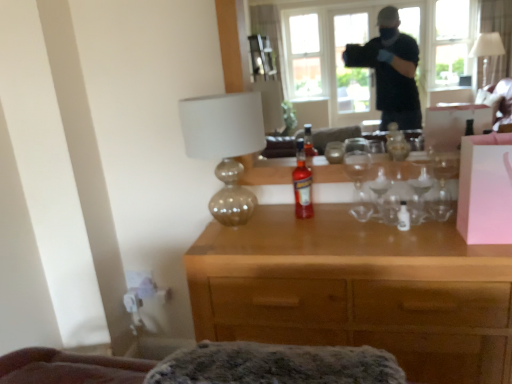
At what (x,y) coordinates should I click in order to perform the action: click on vacant region below matte gold lamp at center (from a real-world perspective). Please return your answer as a coordinate pair (x, y). This screenshot has height=384, width=512. Looking at the image, I should click on (239, 229).